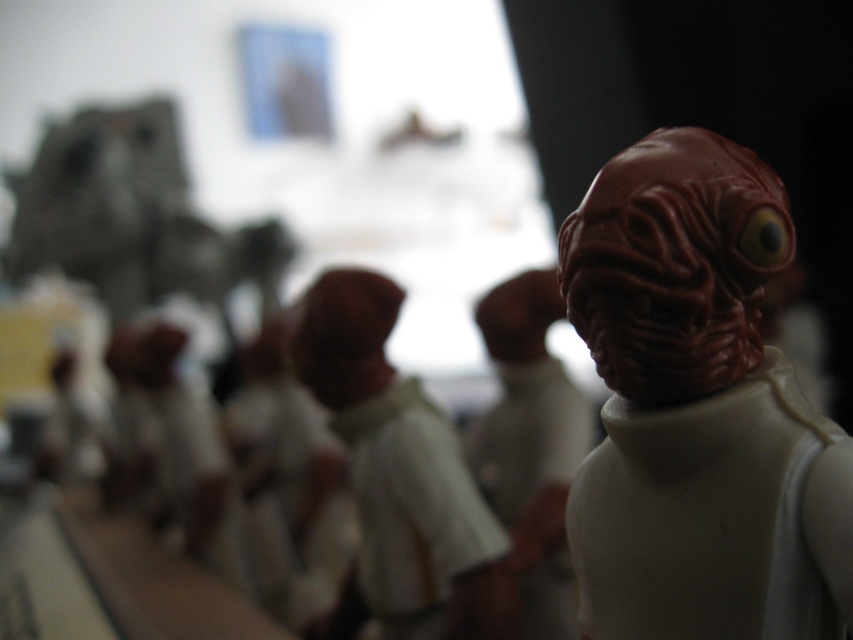
Question: Can you confirm if rubber-like brown alien head at right is positioned below white matte figure at center?

Choices:
 (A) no
 (B) yes

Answer: (A)

Question: Based on their relative distances, which object is nearer to the matte white figure at center?

Choices:
 (A) rubber-like brown alien head at right
 (B) white matte figure at center

Answer: (B)

Question: Based on their relative distances, which object is nearer to the rubber-like brown alien head at right?

Choices:
 (A) white matte figure at center
 (B) matte white figure at center

Answer: (A)

Question: Is white matte figure at center further to camera compared to matte white figure at center?

Choices:
 (A) yes
 (B) no

Answer: (B)

Question: Estimate the real-world distances between objects in this image. Which object is closer to the white matte figure at center?

Choices:
 (A) rubber-like brown alien head at right
 (B) matte white figure at center

Answer: (B)

Question: Can you confirm if rubber-like brown alien head at right is positioned below matte white figure at center?

Choices:
 (A) no
 (B) yes

Answer: (A)